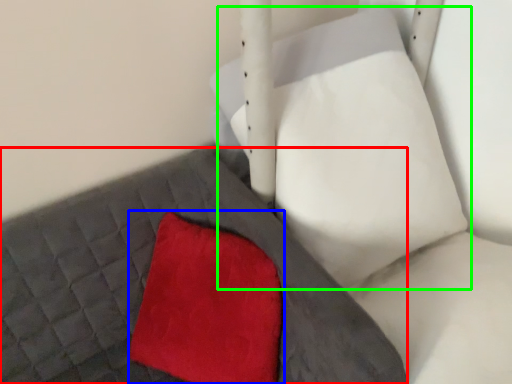
Question: Which object is the closest to the bed frame (highlighted by a red box)? Choose among these: throw pillow (highlighted by a blue box) or bean bag chair (highlighted by a green box).

Choices:
 (A) throw pillow
 (B) bean bag chair

Answer: (A)